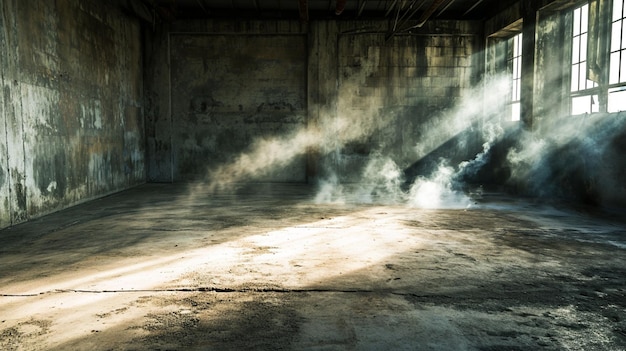
Where is `ceiling`? ceiling is located at coordinates (341, 14).